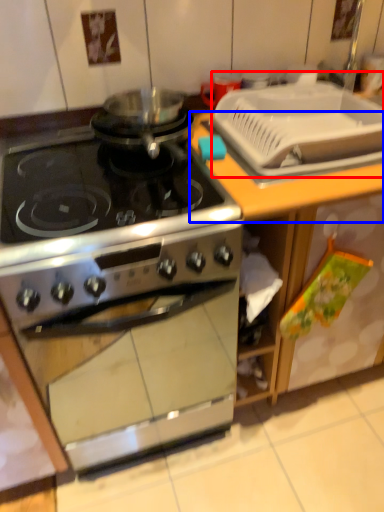
Question: Which object appears farthest to the camera in this image, sink (highlighted by a red box) or counter top (highlighted by a blue box)?

Choices:
 (A) sink
 (B) counter top

Answer: (B)